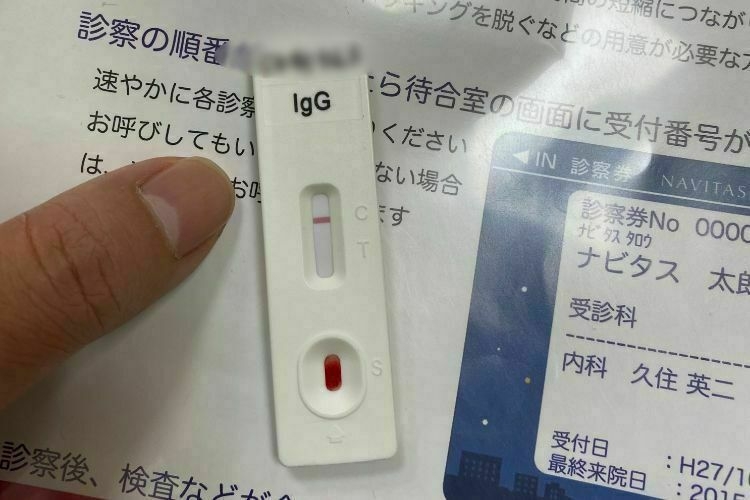
Where is `glare from light`? The image size is (750, 500). glare from light is located at coordinates (633, 59).